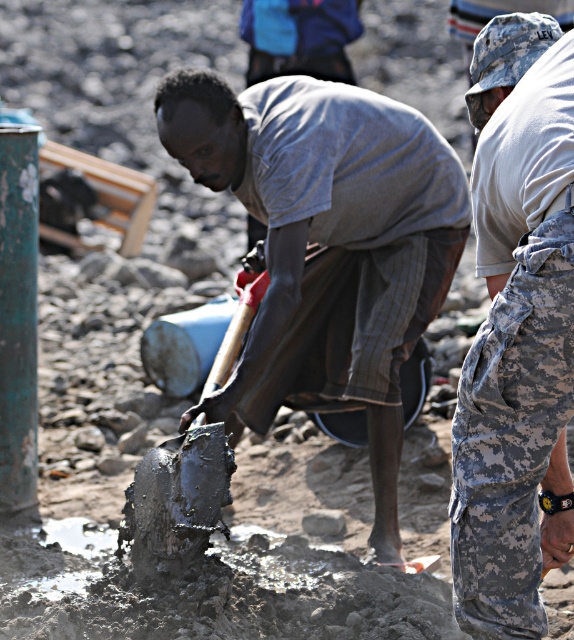
Is point (272, 304) less distant than point (546, 250)?

No, (272, 304) is behind (546, 250).

Can you confirm if matte gray shirt at center is positioned below camouflage pants at right?

No, matte gray shirt at center is not below camouflage pants at right.

Between point (230, 109) and point (494, 486), which one is positioned behind?

Positioned behind is point (230, 109).

Where is `matte gray shirt at center`? This screenshot has height=640, width=574. matte gray shirt at center is located at coordinates (327, 244).